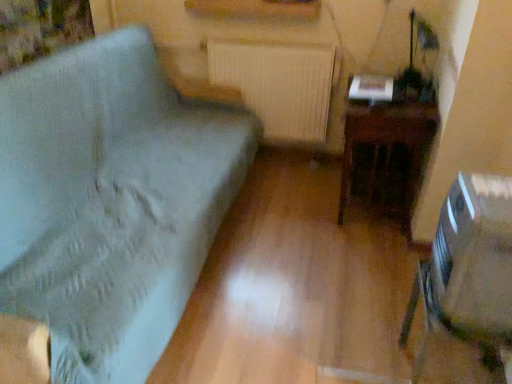
The width and height of the screenshot is (512, 384). In order to click on empty space that is ontop of clear plastic swivel chair at lower right in this screenshot , I will do `click(490, 194)`.